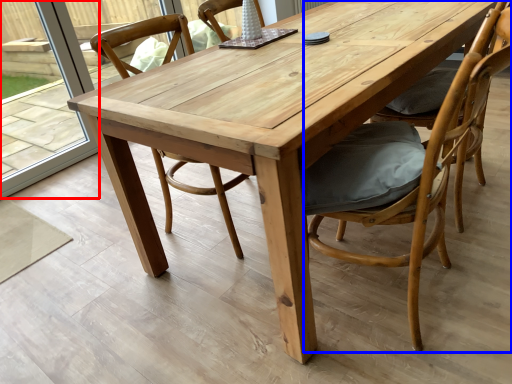
Question: Among these objects, which one is nearest to the camera, glass door (highlighted by a red box) or chair (highlighted by a blue box)?

Choices:
 (A) glass door
 (B) chair

Answer: (B)